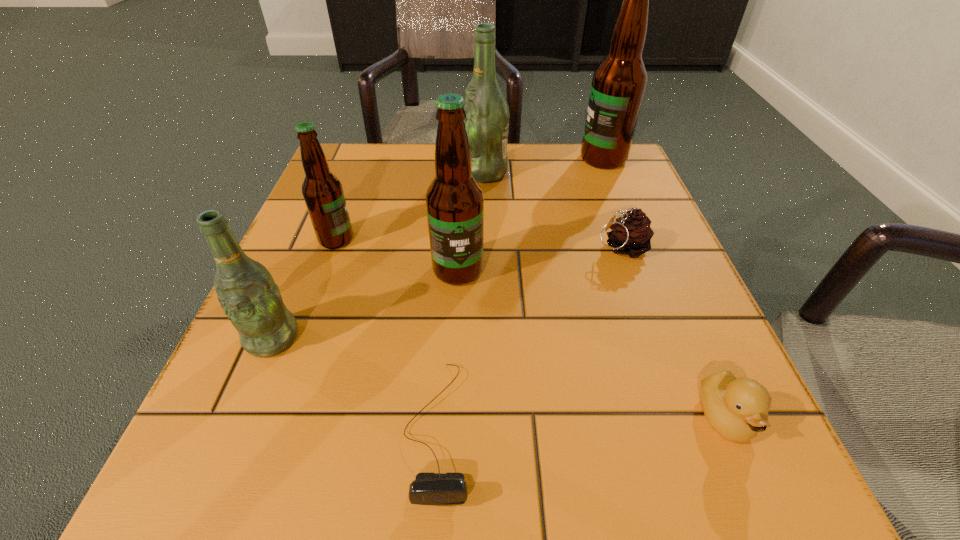
Locate an element on the screen. This screenshot has width=960, height=540. vacant area situated on the label of the second farthest brown beer bottle is located at coordinates 423,240.

This screenshot has height=540, width=960. Identify the location of vacant space located on the surface of the sixth farthest object. (228, 441).

At what (x,y) coordinates should I click in order to perform the action: click on vacant space located 0.400m with a leaf charm attached to the pinecone. Please return your answer as a coordinate pair (x, y). Looking at the image, I should click on (375, 248).

In order to click on vacant space situated with a leaf charm attached to the pinecone in this screenshot , I will do `click(463, 248)`.

The image size is (960, 540). I want to click on free spot located with a leaf charm attached to the pinecone, so click(x=513, y=248).

Where is `duckling present at the near edge`? The width and height of the screenshot is (960, 540). duckling present at the near edge is located at coordinates (737, 409).

This screenshot has height=540, width=960. Find the location of `webcam present at the near edge`. webcam present at the near edge is located at coordinates (432, 489).

This screenshot has width=960, height=540. What are the coordinates of `beer bottle at the right edge` in the screenshot? It's located at (618, 85).

The height and width of the screenshot is (540, 960). I want to click on pinecone positioned at the right edge, so click(631, 234).

At what (x,y) coordinates should I click in order to perform the action: click on duckling at the right edge. Please return your answer as a coordinate pair (x, y). The image size is (960, 540). Looking at the image, I should click on click(737, 409).